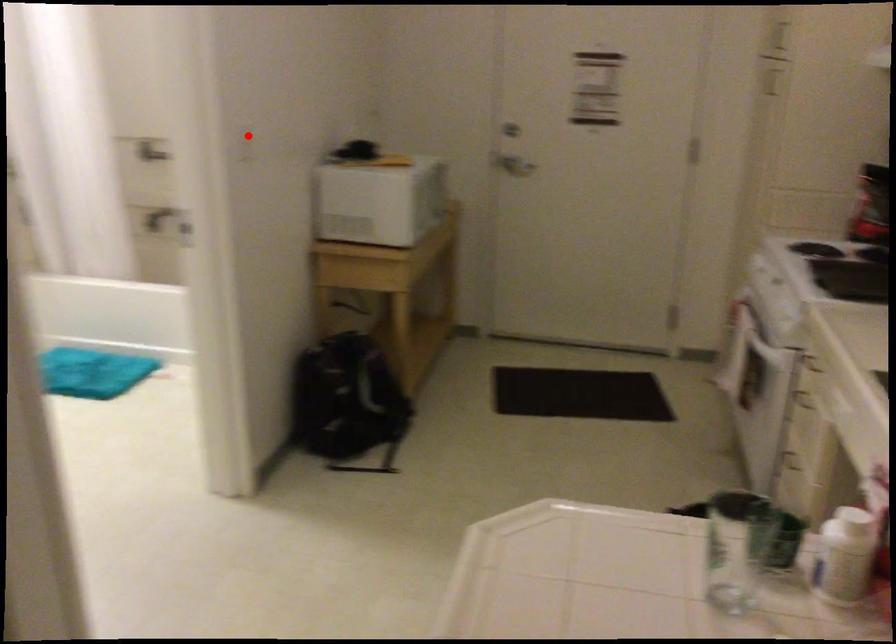
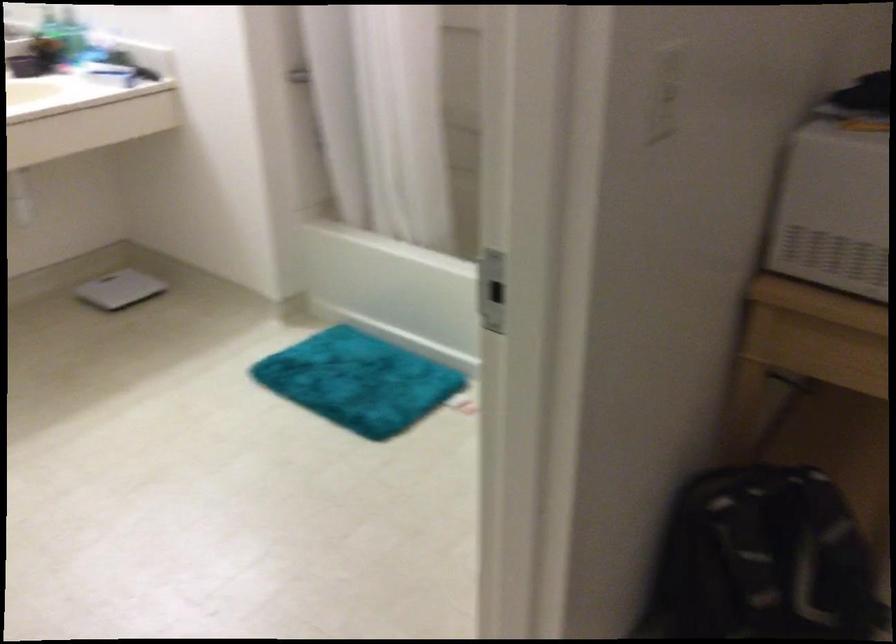
Find the pixel in the second image that matches the highlighted location in the first image.

(666, 93)